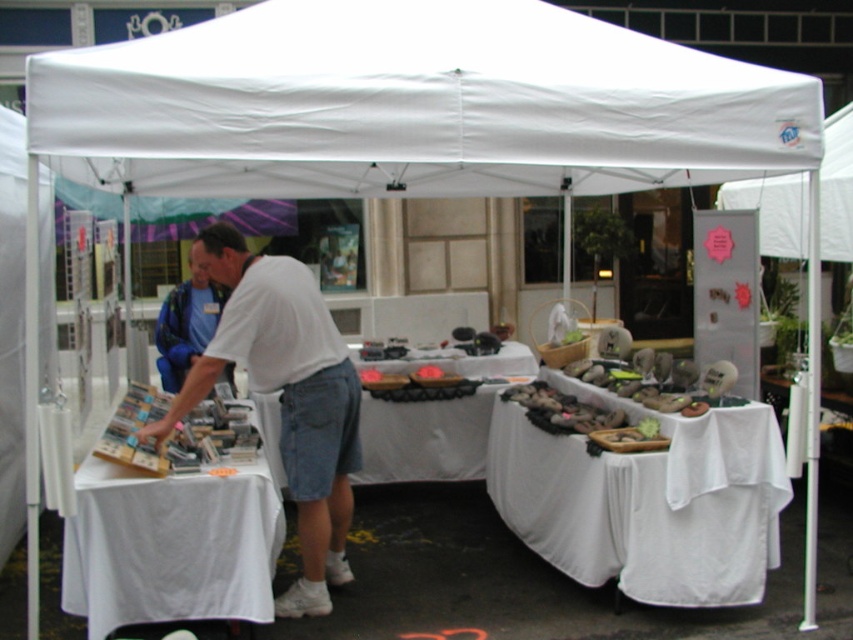
You are a customer at the market and want to reach both the white paper table at left and the white fabric table at center. Which table should you approach first to get the items you need?

You should approach the white paper table at left first because it is closer to you than the white fabric table at center, so you can reach it more easily.